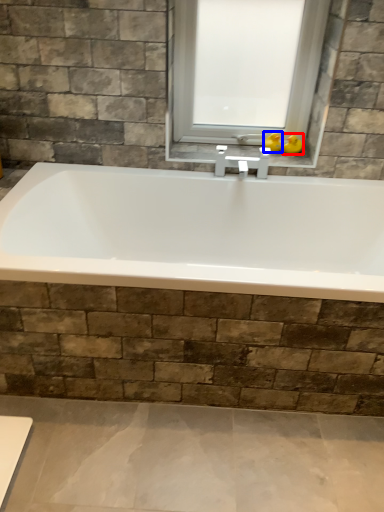
Question: Which point is further to the camera, duck (highlighted by a red box) or duck (highlighted by a blue box)?

Choices:
 (A) duck
 (B) duck

Answer: (B)